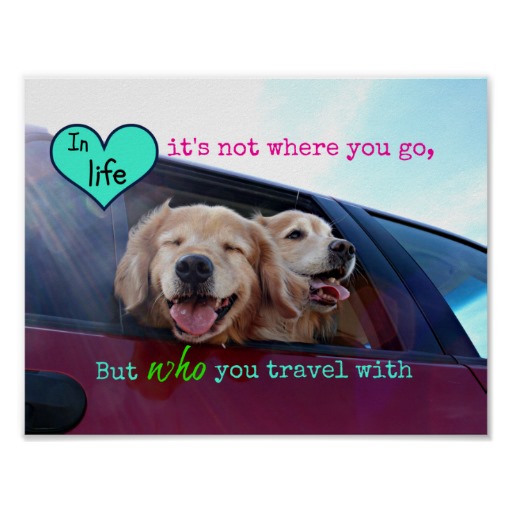
The height and width of the screenshot is (512, 512). I want to click on door handle, so click(79, 399).